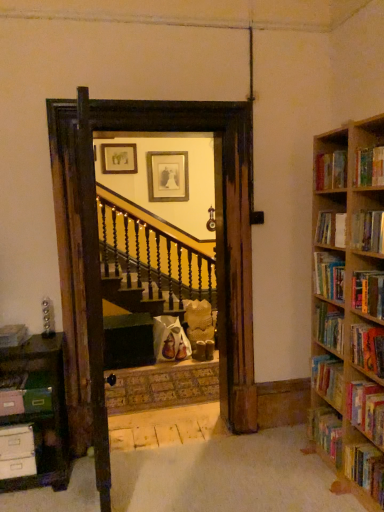
Question: Is hardcover book at right, the 4th book viewed from the right, wider than hardcover book at right, the 9th book viewed from the right?

Choices:
 (A) yes
 (B) no

Answer: (B)

Question: Is hardcover book at right, marked as the 9th book in a left-to-right arrangement, outside of hardcover book at right, the 4th book from the left?

Choices:
 (A) yes
 (B) no

Answer: (A)

Question: Can you confirm if hardcover book at right, marked as the 9th book in a left-to-right arrangement, is positioned to the left of hardcover book at right, the 9th book viewed from the right?

Choices:
 (A) yes
 (B) no

Answer: (B)

Question: Is hardcover book at right, marked as the 9th book in a left-to-right arrangement, thinner than hardcover book at right, the 9th book viewed from the right?

Choices:
 (A) yes
 (B) no

Answer: (A)

Question: Does hardcover book at right, marked as the 9th book in a left-to-right arrangement, lie in front of hardcover book at right, the 9th book viewed from the right?

Choices:
 (A) no
 (B) yes

Answer: (B)

Question: Is hardcover book at right, marked as the 9th book in a left-to-right arrangement, facing towards hardcover book at right, the 4th book from the left?

Choices:
 (A) no
 (B) yes

Answer: (A)

Question: Are hardcover book at right, arranged as the 10th book when viewed from the left, and hardcover book at right, the 9th book viewed from the right, beside each other?

Choices:
 (A) no
 (B) yes

Answer: (A)

Question: From the image's perspective, is hardcover book at right, the 3th book when ordered from right to left, over hardcover book at right, the 9th book viewed from the right?

Choices:
 (A) no
 (B) yes

Answer: (B)

Question: Does hardcover book at right, arranged as the 10th book when viewed from the left, have a greater height compared to hardcover book at right, the 4th book from the left?

Choices:
 (A) yes
 (B) no

Answer: (A)

Question: Is hardcover book at right, the 4th book from the left, at the back of hardcover book at right, the 3th book when ordered from right to left?

Choices:
 (A) no
 (B) yes

Answer: (A)

Question: Is hardcover book at right, arranged as the 10th book when viewed from the left, surrounding hardcover book at right, the 4th book from the left?

Choices:
 (A) no
 (B) yes

Answer: (A)

Question: Is hardcover book at right, the 3th book when ordered from right to left, positioned before hardcover book at right, the 4th book from the left?

Choices:
 (A) yes
 (B) no

Answer: (A)

Question: From the image's perspective, is hardcover book at right, the twelfth book viewed from the left, below matte pink book at left, positioned as the 11th book in right-to-left order?

Choices:
 (A) no
 (B) yes

Answer: (B)